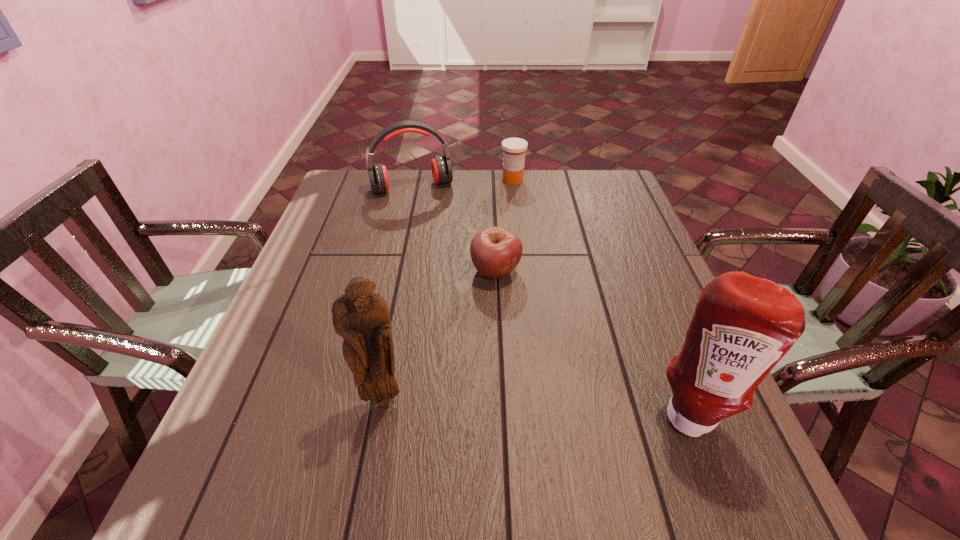
In order to click on free space located on the side of the third farthest object with the unique marking in this screenshot , I will do tap(526, 344).

At what (x,y) coordinates should I click in order to perform the action: click on vacant space located 0.360m on the label of the fourth tallest object. Please return your answer as a coordinate pair (x, y). Looking at the image, I should click on coord(512,257).

This screenshot has width=960, height=540. I want to click on free space located 0.070m on the label of the fourth tallest object, so click(x=513, y=198).

Where is `vacant space located 0.110m on the label of the fourth tallest object`? This screenshot has height=540, width=960. vacant space located 0.110m on the label of the fourth tallest object is located at coordinates (513, 205).

Find the location of a particular element. free region located on the ear cups of the third shortest object is located at coordinates (449, 274).

At what (x,y) coordinates should I click in order to perform the action: click on blank space located 0.120m on the ear cups of the third shortest object. Please return your answer as a coordinate pair (x, y). Image resolution: width=960 pixels, height=540 pixels. Looking at the image, I should click on click(430, 221).

Locate an element on the screen. free space located on the ear cups of the third shortest object is located at coordinates (427, 214).

Locate an element on the screen. This screenshot has height=540, width=960. medicine that is at the far edge is located at coordinates (514, 149).

At what (x,y) coordinates should I click in order to perform the action: click on earphone that is at the far edge. Please return your answer as a coordinate pair (x, y). Image resolution: width=960 pixels, height=540 pixels. Looking at the image, I should click on (441, 167).

Locate an element on the screen. The image size is (960, 540). figurine located at the near edge is located at coordinates (361, 317).